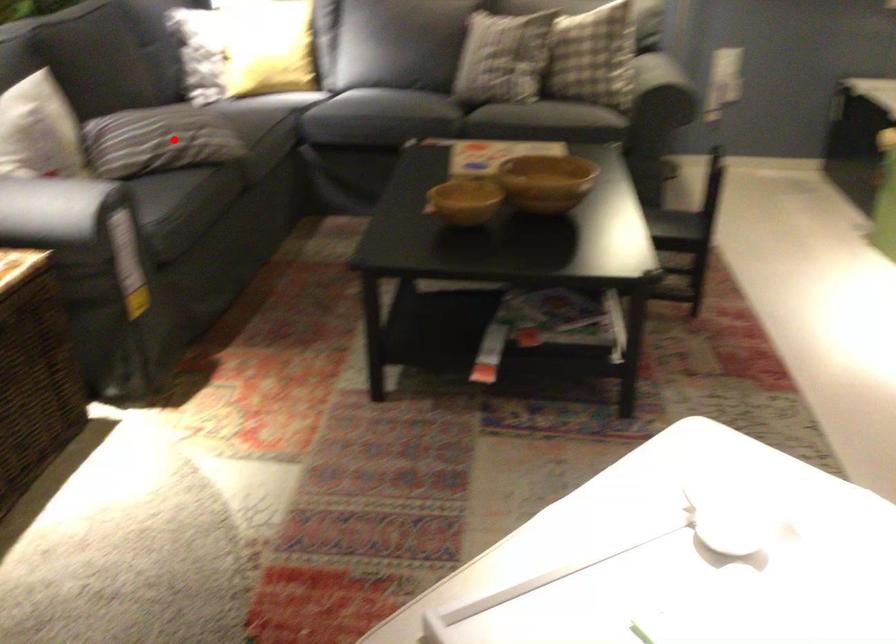
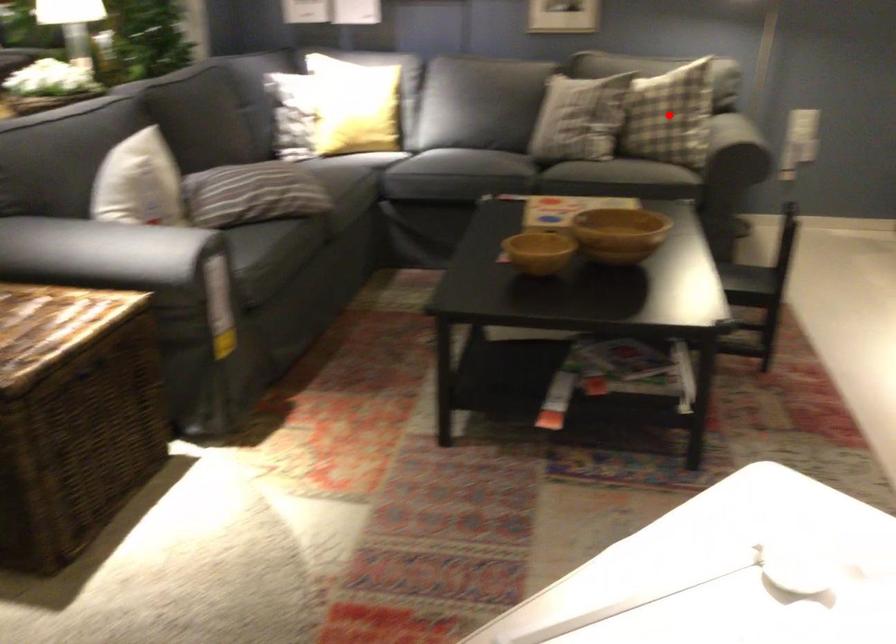
I am providing you with two images of the same scene from different viewpoints. A red point is marked on the first image and another point is marked on the second image. Do the highlighted points in image1 and image2 indicate the same real-world spot?

No